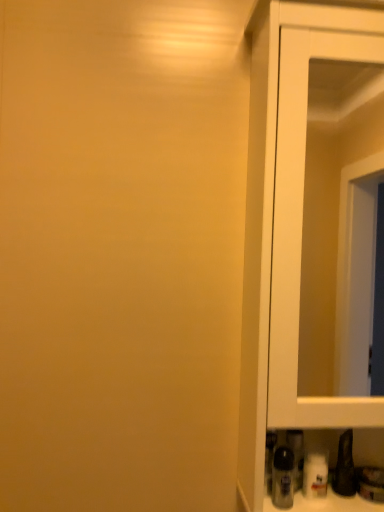
Describe the element at coordinates (269, 216) in the screenshot. Image resolution: width=384 pixels, height=512 pixels. I see `white glossy cupboard at right` at that location.

Find the location of a particular element. This screenshot has width=384, height=512. white glossy cupboard at right is located at coordinates (269, 216).

Describe the element at coordinates (283, 478) in the screenshot. I see `translucent plastic bottle at lower right` at that location.

Image resolution: width=384 pixels, height=512 pixels. Identify the location of translucent plastic bottle at lower right. (283, 478).

Locate an element on the screen. This screenshot has height=512, width=384. white glossy cupboard at right is located at coordinates (269, 216).

Does translucent plastic bottle at lower right appear on the right side of white glossy cupboard at right?

In fact, translucent plastic bottle at lower right is to the left of white glossy cupboard at right.

In the image, is translucent plastic bottle at lower right positioned in front of or behind white glossy cupboard at right?

Visually, translucent plastic bottle at lower right is located behind white glossy cupboard at right.

Is point (289, 469) less distant than point (248, 424)?

Yes, point (289, 469) is closer to viewer.

From the image's perspective, which object appears higher, translucent plastic bottle at lower right or white glossy cupboard at right?

white glossy cupboard at right appears higher in the image.

From a real-world perspective, which object stands above the other?

In real-world perspective, white glossy cupboard at right is above.

Is translucent plastic bottle at lower right thinner than white glossy cupboard at right?

Indeed, translucent plastic bottle at lower right has a lesser width compared to white glossy cupboard at right.

From their relative heights in the image, would you say translucent plastic bottle at lower right is taller or shorter than white glossy cupboard at right?

translucent plastic bottle at lower right is shorter than white glossy cupboard at right.

Does translucent plastic bottle at lower right have a larger size compared to white glossy cupboard at right?

No.

Looking at this image, would you say white glossy cupboard at right is part of translucent plastic bottle at lower right's contents?

That's incorrect, white glossy cupboard at right is not inside translucent plastic bottle at lower right.

Is translucent plastic bottle at lower right placed right next to white glossy cupboard at right?

No, translucent plastic bottle at lower right is not making contact with white glossy cupboard at right.

Is translucent plastic bottle at lower right aimed at white glossy cupboard at right?

Yes, translucent plastic bottle at lower right is turned towards white glossy cupboard at right.

Find the location of a particular element. This screenshot has width=384, height=512. bottle beneath the white glossy cupboard at right (from a real-world perspective) is located at coordinates (283, 478).

Does white glossy cupboard at right appear on the left side of translucent plastic bottle at lower right?

In fact, white glossy cupboard at right is to the right of translucent plastic bottle at lower right.

Relative to translucent plastic bottle at lower right, is white glossy cupboard at right in front or behind?

Visually, white glossy cupboard at right is located in front of translucent plastic bottle at lower right.

Considering the positions of point (267, 101) and point (292, 479), is point (267, 101) closer or farther from the camera than point (292, 479)?

Point (267, 101).

From the image's perspective, which is above, white glossy cupboard at right or translucent plastic bottle at lower right?

white glossy cupboard at right, from the image's perspective.

From a real-world perspective, is white glossy cupboard at right above or below translucent plastic bottle at lower right?

In terms of real-world spatial position, white glossy cupboard at right is above translucent plastic bottle at lower right.

Which object is thinner, white glossy cupboard at right or translucent plastic bottle at lower right?

Thinner between the two is translucent plastic bottle at lower right.

Considering the sizes of white glossy cupboard at right and translucent plastic bottle at lower right in the image, is white glossy cupboard at right taller or shorter than translucent plastic bottle at lower right?

Clearly, white glossy cupboard at right is taller compared to translucent plastic bottle at lower right.

Is white glossy cupboard at right bigger than translucent plastic bottle at lower right?

Correct, white glossy cupboard at right is larger in size than translucent plastic bottle at lower right.

Is white glossy cupboard at right located outside translucent plastic bottle at lower right?

Indeed, white glossy cupboard at right is completely outside translucent plastic bottle at lower right.

Are white glossy cupboard at right and translucent plastic bottle at lower right beside each other?

white glossy cupboard at right is not next to translucent plastic bottle at lower right, and they're not touching.

Is white glossy cupboard at right looking in the opposite direction of translucent plastic bottle at lower right?

Correct, white glossy cupboard at right is looking away from translucent plastic bottle at lower right.

How many degrees apart are the facing directions of white glossy cupboard at right and translucent plastic bottle at lower right?

They differ by 0.532 degrees in their facing directions.

Locate an element on the screen. cupboard above the translucent plastic bottle at lower right (from the image's perspective) is located at coordinates (269, 216).

Where is `cupboard on the right of translucent plastic bottle at lower right`? The image size is (384, 512). cupboard on the right of translucent plastic bottle at lower right is located at coordinates (269, 216).

Where is `bottle on the left of the white glossy cupboard at right`? The image size is (384, 512). bottle on the left of the white glossy cupboard at right is located at coordinates (283, 478).